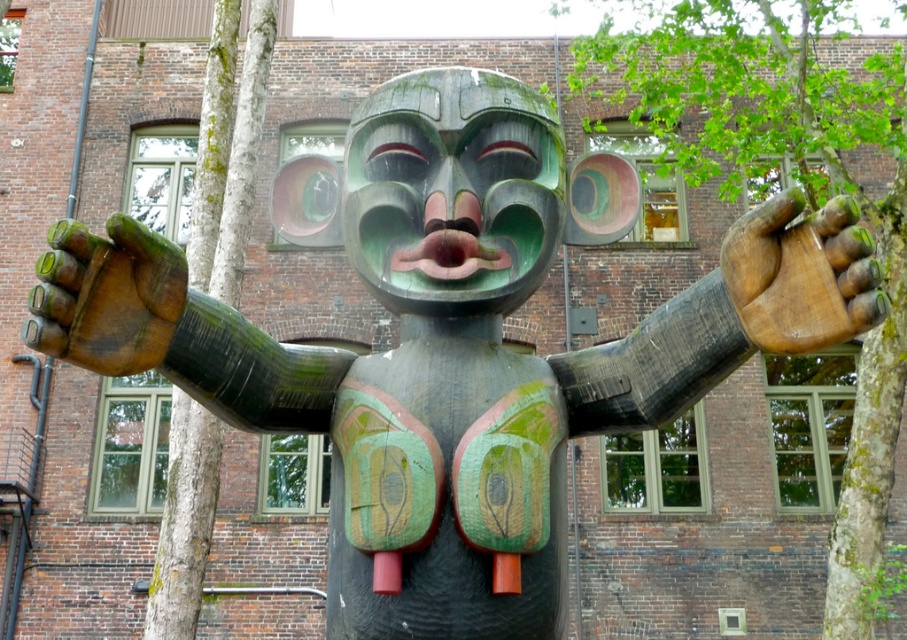
Question: Based on their relative distances, which object is farther from the green mossy tree trunk at center?

Choices:
 (A) green rough bark tree at left
 (B) metallic pipe at left

Answer: (B)

Question: Considering the relative positions of green mossy tree trunk at center and green rough bark tree at left in the image provided, where is green mossy tree trunk at center located with respect to green rough bark tree at left?

Choices:
 (A) above
 (B) below

Answer: (B)

Question: Does green rough bark tree at left appear on the left side of metallic pipe at left?

Choices:
 (A) yes
 (B) no

Answer: (B)

Question: Which object is positioned closest to the metallic pipe at left?

Choices:
 (A) green rough bark tree at left
 (B) green mossy tree trunk at center

Answer: (A)

Question: Among these objects, which one is nearest to the camera?

Choices:
 (A) green rough bark tree at left
 (B) green mossy tree trunk at center

Answer: (B)

Question: Considering the relative positions of green mossy tree trunk at center and green rough bark tree at left in the image provided, where is green mossy tree trunk at center located with respect to green rough bark tree at left?

Choices:
 (A) above
 (B) below

Answer: (B)